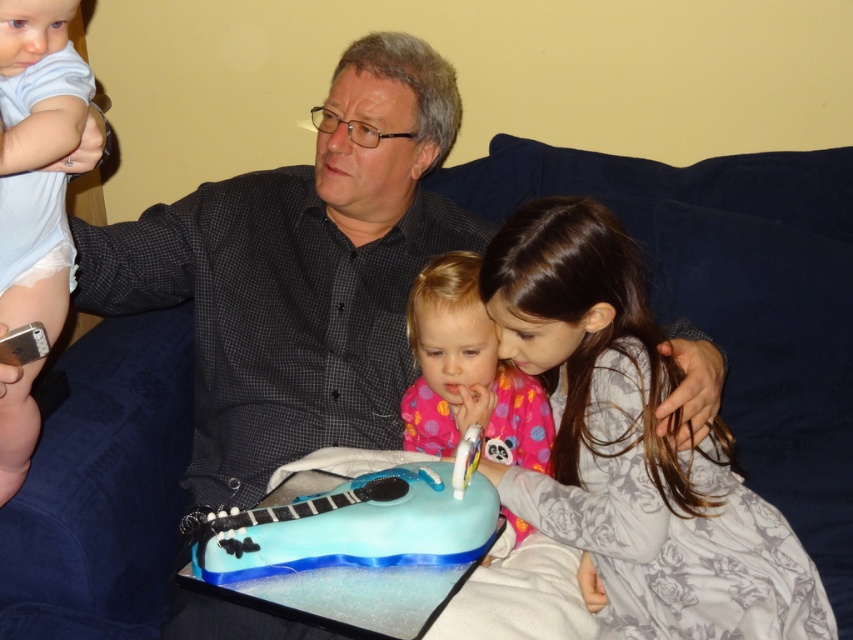
You are a photographer trying to capture a candid shot of the two children in the scene. You want to ensure both the fluffy gray dress at lower right and the light blue cotton onesie at left are visible in the frame. Based on their positions, which child should you focus on first to ensure both are in the shot?

The fluffy gray dress at lower right is located below the light blue cotton onesie at left. To capture both in the frame, focus on the light blue cotton onesie at left first as it is higher up, ensuring the lower positioned fluffy gray dress at lower right remains within the shot.

You are a photographer standing in the scene and want to take a photo of the fluffy gray dress at lower right. Where should you position your camera to ensure the dress is centered in the photo?

To center the fluffy gray dress at lower right in the photo, position the camera so that it is directly aligned with the coordinates point (x=631, y=448), which is the 2D location of the dress.

You are a photographer trying to capture a candid shot of the two children in the scene. The pink fabric at center and the light blue cotton onesie at left are both in the frame. Based on their positions, which object is closer to the camera?

The light blue cotton onesie at left is closer to the camera because the pink fabric at center is positioned below it, indicating it is further away.